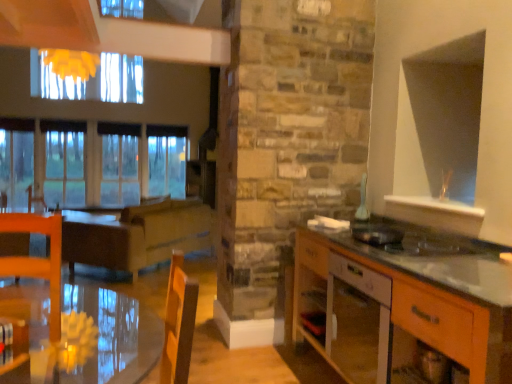
Question: From a real-world perspective, is white glossy vase at upper right, the 2th appliance from the bottom, beneath wooden cabinet at right?

Choices:
 (A) yes
 (B) no

Answer: (B)

Question: Does white glossy vase at upper right, which is the 1th appliance from top to bottom, lie behind wooden cabinet at right?

Choices:
 (A) yes
 (B) no

Answer: (A)

Question: Can you confirm if white glossy vase at upper right, which is the 1th appliance from top to bottom, is wider than wooden cabinet at right?

Choices:
 (A) no
 (B) yes

Answer: (A)

Question: Would you consider white glossy vase at upper right, which is the 1th appliance from top to bottom, to be distant from wooden cabinet at right?

Choices:
 (A) yes
 (B) no

Answer: (B)

Question: From the image's perspective, is white glossy vase at upper right, the 2th appliance from the bottom, on wooden cabinet at right?

Choices:
 (A) yes
 (B) no

Answer: (A)

Question: Is metallic silver toaster at right, acting as the 2th appliance starting from the back, to the left or to the right of transparent glass window at left in the image?

Choices:
 (A) right
 (B) left

Answer: (A)

Question: In terms of height, does metallic silver toaster at right, acting as the 2th appliance starting from the back, look taller or shorter compared to transparent glass window at left?

Choices:
 (A) short
 (B) tall

Answer: (A)

Question: Looking at the image, does metallic silver toaster at right, acting as the 2th appliance starting from the back, seem bigger or smaller compared to transparent glass window at left?

Choices:
 (A) big
 (B) small

Answer: (B)

Question: Is metallic silver toaster at right, which ranks as the 1th appliance in bottom-to-top order, situated inside transparent glass window at left or outside?

Choices:
 (A) inside
 (B) outside

Answer: (B)

Question: Would you say white glossy vase at upper right, arranged as the second appliance when viewed from the front, is inside or outside brown wooden table at center?

Choices:
 (A) inside
 (B) outside

Answer: (B)

Question: Considering the positions of point tap(364, 175) and point tap(139, 205), is point tap(364, 175) closer or farther from the camera than point tap(139, 205)?

Choices:
 (A) closer
 (B) farther

Answer: (A)

Question: Looking at their shapes, would you say white glossy vase at upper right, arranged as the second appliance when viewed from the front, is wider or thinner than brown wooden table at center?

Choices:
 (A) thin
 (B) wide

Answer: (A)

Question: In terms of size, does white glossy vase at upper right, the first appliance in the back-to-front sequence, appear bigger or smaller than brown wooden table at center?

Choices:
 (A) small
 (B) big

Answer: (A)

Question: Is brown wooden table at center wider or thinner than wooden cabinet at right?

Choices:
 (A) thin
 (B) wide

Answer: (B)

Question: From the image's perspective, relative to wooden cabinet at right, is brown wooden table at center above or below?

Choices:
 (A) above
 (B) below

Answer: (A)